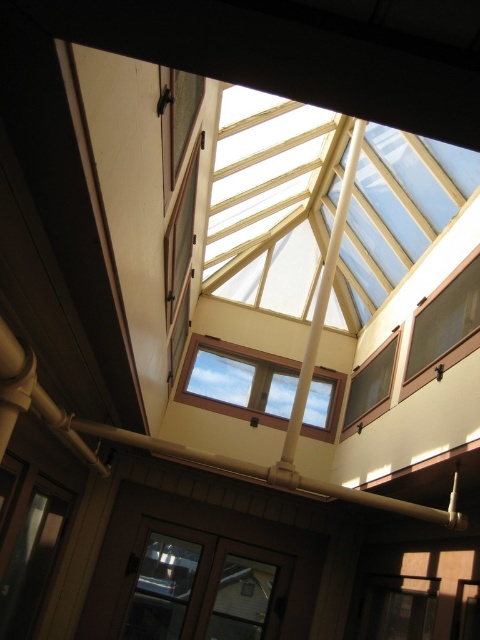
Question: Based on their relative distances, which object is nearer to the clear glass window at lower center?

Choices:
 (A) clear glass window at upper right
 (B) clear glass door at lower center

Answer: (B)

Question: In this image, where is clear glass door at lower center located relative to clear glass window at center?

Choices:
 (A) below
 (B) above

Answer: (A)

Question: Can you confirm if clear glass door at lower center is positioned to the right of clear glass window at lower center?

Choices:
 (A) yes
 (B) no

Answer: (B)

Question: Which of these objects is positioned farthest from the clear glass window at lower center?

Choices:
 (A) clear glass window at center
 (B) clear glass window at upper right
 (C) matte wood window at center
 (D) clear glass door at lower center

Answer: (A)

Question: Which object is farther from the camera taking this photo?

Choices:
 (A) clear glass window at center
 (B) matte wood window at center
 (C) clear glass window at upper right
 (D) clear glass door at lower center

Answer: (A)

Question: Does clear glass window at upper right appear over clear glass window at lower center?

Choices:
 (A) yes
 (B) no

Answer: (A)